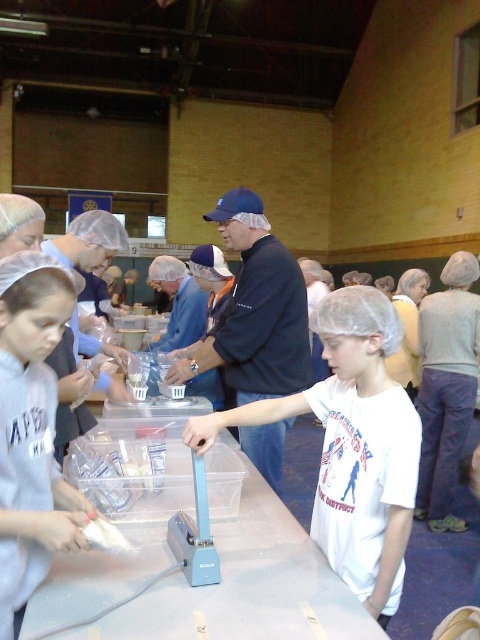
Question: Is clear plastic table at center bigger than blue fabric shirt at center?

Choices:
 (A) yes
 (B) no

Answer: (B)

Question: Which point is farther from the camera taking this photo?

Choices:
 (A) 404,394
 (B) 84,426
 (C) 248,278

Answer: (C)

Question: Based on their relative distances, which object is farther from the clear plastic table at center?

Choices:
 (A) white fabric hairnet at left
 (B) dark blue cap at center
 (C) white matte shirt at center
 (D) blue fabric shirt at center

Answer: (B)

Question: Where is clear plastic table at center located in relation to dark blue cap at center in the image?

Choices:
 (A) right
 (B) left

Answer: (A)

Question: Can you confirm if white matte shirt at center is positioned to the right of clear plastic table at center?

Choices:
 (A) yes
 (B) no

Answer: (A)

Question: Among these objects, which one is farthest from the camera?

Choices:
 (A) clear plastic table at center
 (B) blue fabric shirt at center
 (C) dark blue cap at center

Answer: (C)